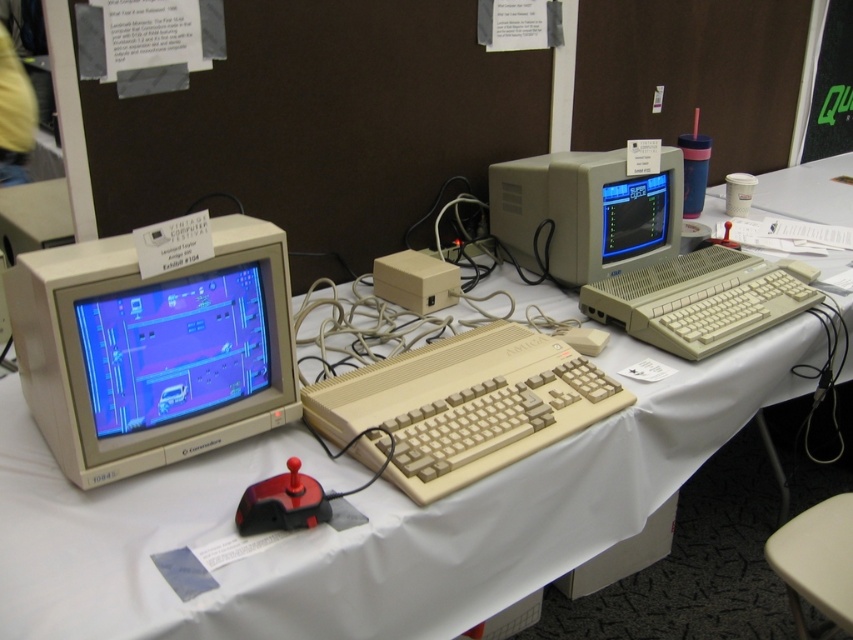
Who is higher up, beige plastic keyboard at center or rubberized black mouse at center?

rubberized black mouse at center

Is beige plastic keyboard at center behind rubberized black mouse at center?

No, beige plastic keyboard at center is in front of rubberized black mouse at center.

At what (x,y) coordinates should I click in order to perform the action: click on beige plastic keyboard at center. Please return your answer as a coordinate pair (x, y). The width and height of the screenshot is (853, 640). Looking at the image, I should click on (465, 404).

Where is `beige plastic keyboard at center`? beige plastic keyboard at center is located at coordinates (465, 404).

Which is below, beige plastic keyboard at center or shiny blue crt monitor at left?

beige plastic keyboard at center is below.

Does beige plastic keyboard at center appear on the right side of shiny blue crt monitor at left?

Yes, beige plastic keyboard at center is to the right of shiny blue crt monitor at left.

This screenshot has width=853, height=640. Identify the location of beige plastic keyboard at center. (465, 404).

Between point (236, 276) and point (94, 301), which one is positioned behind?

The point (236, 276) is behind.

Can you confirm if matte beige monitor at left is shorter than shiny blue crt monitor at left?

Incorrect, matte beige monitor at left's height does not fall short of shiny blue crt monitor at left's.

The width and height of the screenshot is (853, 640). Find the location of `matte beige monitor at left`. matte beige monitor at left is located at coordinates (154, 349).